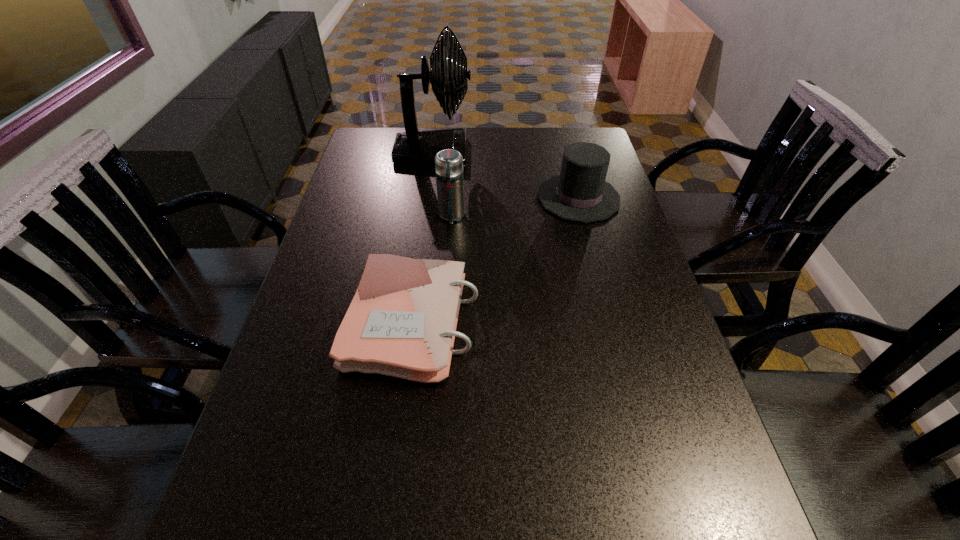
You are a GUI agent. You are given a task and a screenshot of the screen. Output one action in this format:
    pyautogui.click(x=<x>, y=<y>)
    Task: Click on the fan
    The image size is (960, 540).
    Given the screenshot: What is the action you would take?
    pyautogui.click(x=416, y=147)

You are a GUI agent. You are given a task and a screenshot of the screen. Output one action in this format:
    pyautogui.click(x=<x>, y=<y>)
    Task: Click on the thermos bottle
    
    Given the screenshot: What is the action you would take?
    pyautogui.click(x=448, y=163)

Identify the location of the rightmost object. (579, 193).

Image resolution: width=960 pixels, height=540 pixels. What are the coordinates of `the third tallest object` in the screenshot? It's located at (579, 193).

Find the location of a particular element. This screenshot has width=960, height=540. phonebook is located at coordinates (402, 320).

Image resolution: width=960 pixels, height=540 pixels. I want to click on the shortest object, so click(402, 320).

You are a GUI agent. You are given a task and a screenshot of the screen. Output one action in this format:
    pyautogui.click(x=<x>, y=<y>)
    Task: Click on the free space located 0.130m in front of the tallest object to blow air
    This screenshot has height=540, width=960.
    Given the screenshot: What is the action you would take?
    pyautogui.click(x=508, y=153)

You are a GUI agent. You are given a task and a screenshot of the screen. Output one action in this format:
    pyautogui.click(x=<x>, y=<y>)
    Task: Click on the free space located 0.070m with a handle on the side of the thermos bottle
    The height and width of the screenshot is (540, 960).
    Given the screenshot: What is the action you would take?
    pyautogui.click(x=449, y=243)

Where is `free space located on the front of the rightmost object with the decoration`? Image resolution: width=960 pixels, height=540 pixels. free space located on the front of the rightmost object with the decoration is located at coordinates (477, 198).

What are the coordinates of `vacant space located 0.400m on the front of the rightmost object with the decoration` in the screenshot? It's located at (411, 198).